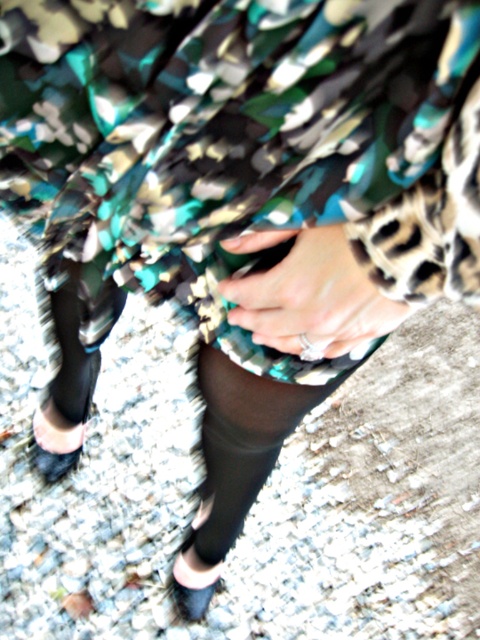
Question: Considering the real-world distances, which object is farthest from the printed fabric dress at center?

Choices:
 (A) matte black sandal at lower left
 (B) black suede shoe at lower center
 (C) black leather shoe at lower left

Answer: (B)

Question: Does printed fabric dress at center appear on the left side of black leather shoe at lower left?

Choices:
 (A) yes
 (B) no

Answer: (B)

Question: Does black sheer sock at lower center have a lesser width compared to black suede shoe at lower center?

Choices:
 (A) yes
 (B) no

Answer: (B)

Question: Which point is closer to the camera?

Choices:
 (A) (217, 580)
 (B) (224, 435)
 (C) (38, 417)
 (D) (99, 353)

Answer: (B)

Question: Which point is closer to the camera taking this photo?

Choices:
 (A) (154, 134)
 (B) (43, 444)
 (C) (200, 604)
 (D) (224, 481)

Answer: (A)

Question: Is the position of black sheer sock at lower center more distant than that of matte black sandal at lower left?

Choices:
 (A) yes
 (B) no

Answer: (B)